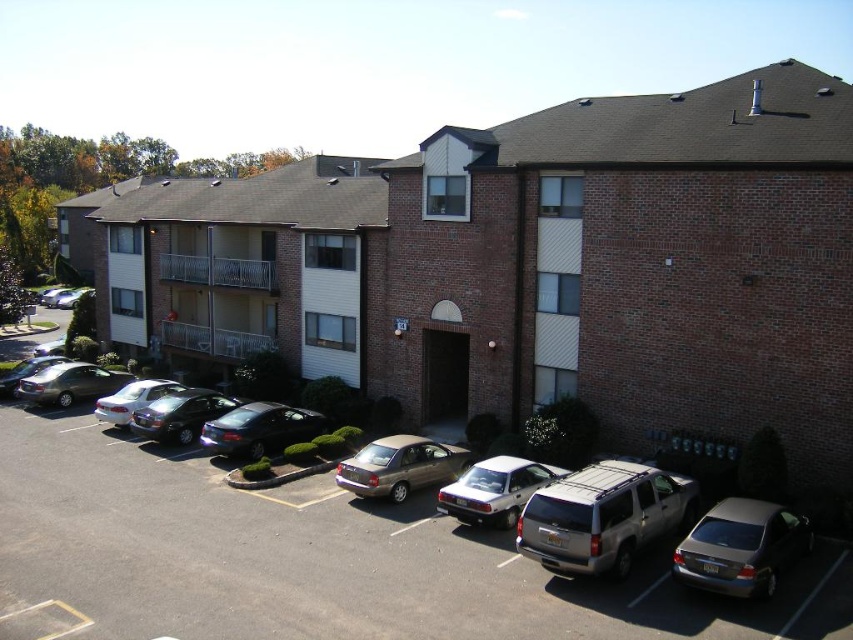
Question: Is satin black sedan at center positioned at the back of matte black sedan at lower left?

Choices:
 (A) no
 (B) yes

Answer: (A)

Question: Which of the following is the closest to the observer?

Choices:
 (A) (59, 362)
 (B) (490, 524)
 (C) (646, 484)
 (D) (422, 452)

Answer: (C)

Question: Does metallic silver sedan at lower right appear under metallic silver sedan at center?

Choices:
 (A) yes
 (B) no

Answer: (A)

Question: Among these objects, which one is nearest to the camera?

Choices:
 (A) shiny silver sedan at left
 (B) matte black sedan at lower left
 (C) silver metallic sedan at lower left

Answer: (C)

Question: From the image, what is the correct spatial relationship of silver metallic sedan at center in relation to silver metallic sedan at lower left?

Choices:
 (A) right
 (B) left

Answer: (A)

Question: Which point is farther to the camera?

Choices:
 (A) shiny silver sedan at left
 (B) silver metallic suv at center
 (C) metallic silver sedan at center

Answer: (C)